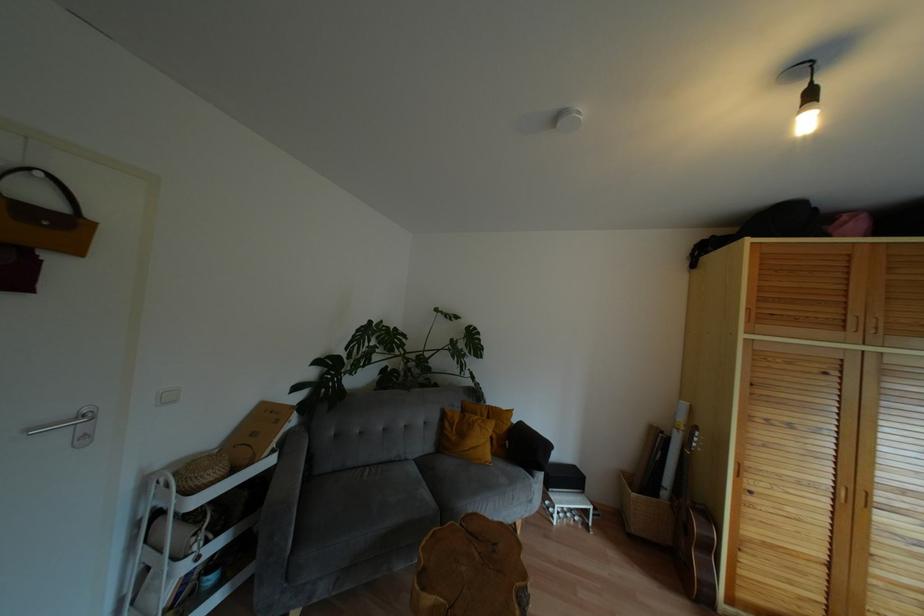
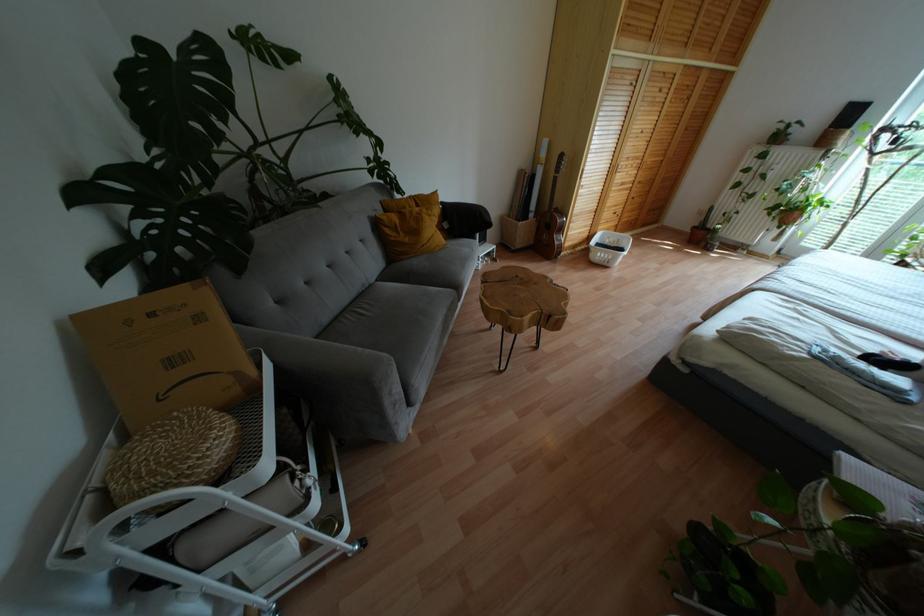
Find the pixel in the second image that matches (275,421) in the first image.

(199, 317)